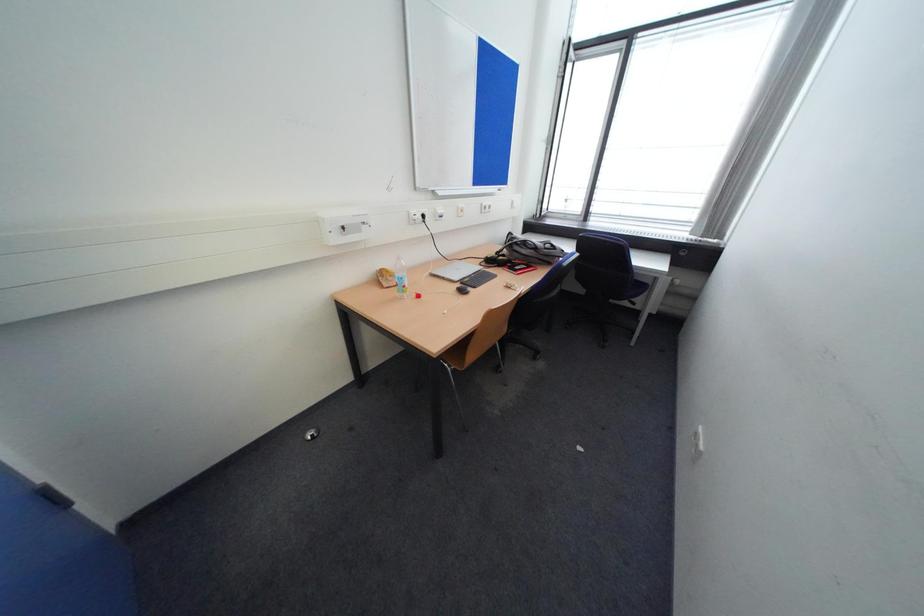
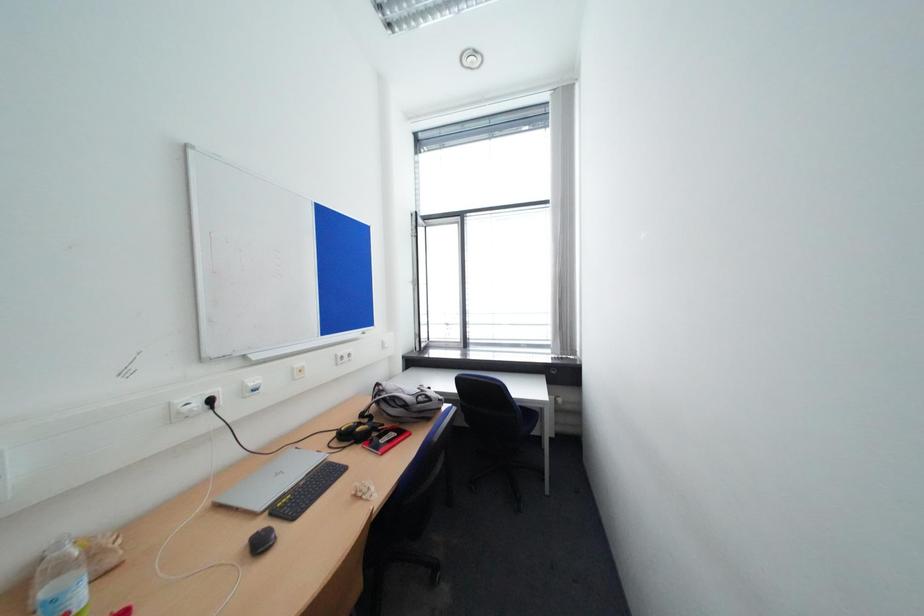
The first image is from the beginning of the video and the second image is from the end. How did the camera likely rotate when shooting the video?

The camera's rotation is toward right-up.